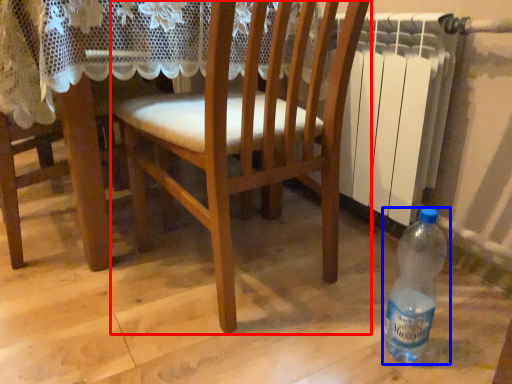
Question: Among these objects, which one is nearest to the camera, chair (highlighted by a red box) or bottle (highlighted by a blue box)?

Choices:
 (A) chair
 (B) bottle

Answer: (A)